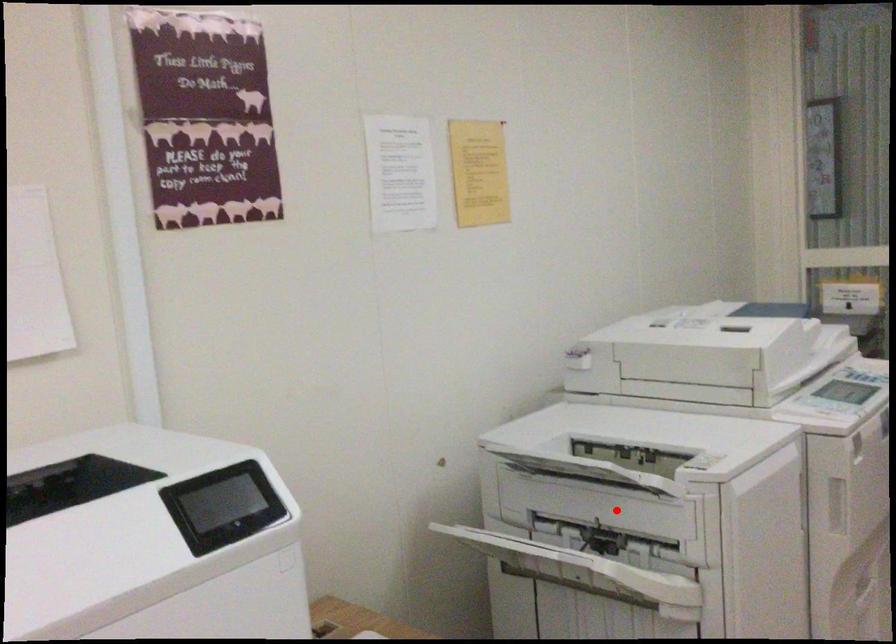
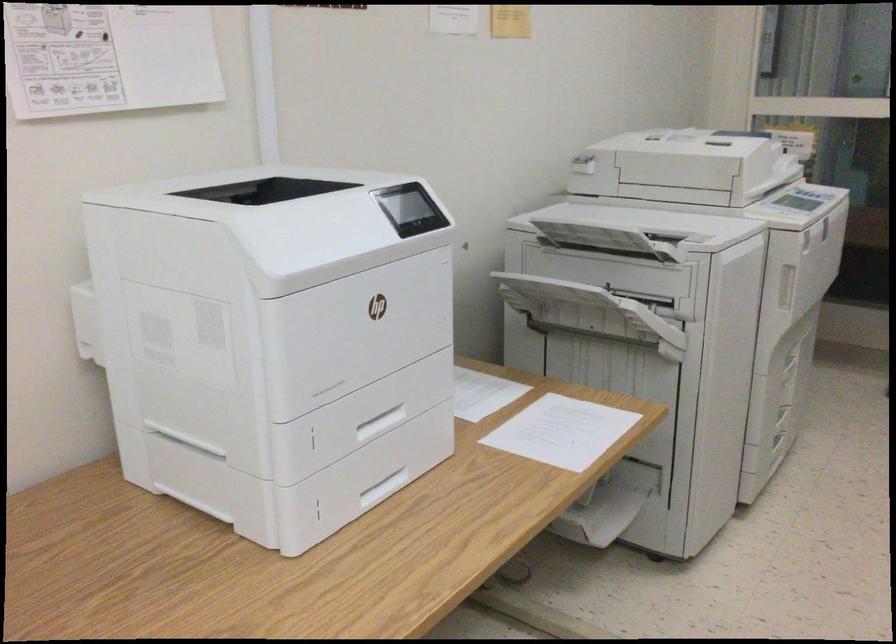
Question: I am providing you with two images of the same scene from different viewpoints. In image1, a red point is highlighted. Considering the same 3D point in image2, which of the following is correct?

Choices:
 (A) It is closer
 (B) It is farther

Answer: (B)